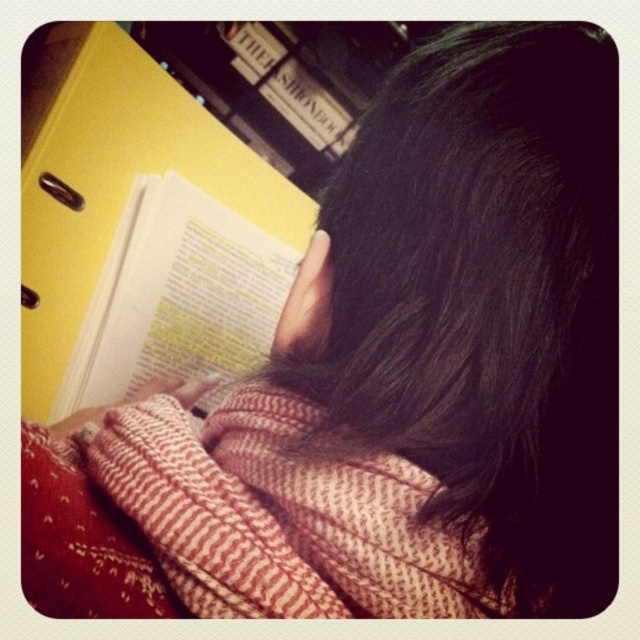
Can you confirm if dark brown hair at upper center is positioned above white paper book at upper left?

Yes.

Is dark brown hair at upper center to the left of white paper book at upper left from the viewer's perspective?

No, dark brown hair at upper center is not to the left of white paper book at upper left.

Which is in front, point (541, 184) or point (176, 237)?

Positioned in front is point (541, 184).

You are a GUI agent. You are given a task and a screenshot of the screen. Output one action in this format:
    pyautogui.click(x=<x>, y=<y>)
    Task: Click on the dark brown hair at upper center
    The width and height of the screenshot is (640, 640).
    Given the screenshot: What is the action you would take?
    pyautogui.click(x=474, y=259)